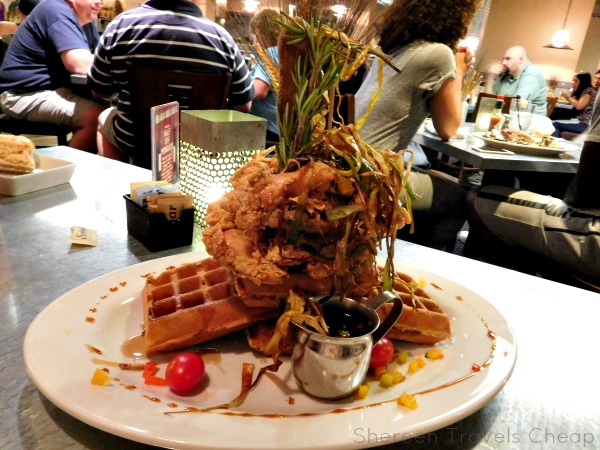
I want to click on metal syrup cup, so click(x=348, y=367).